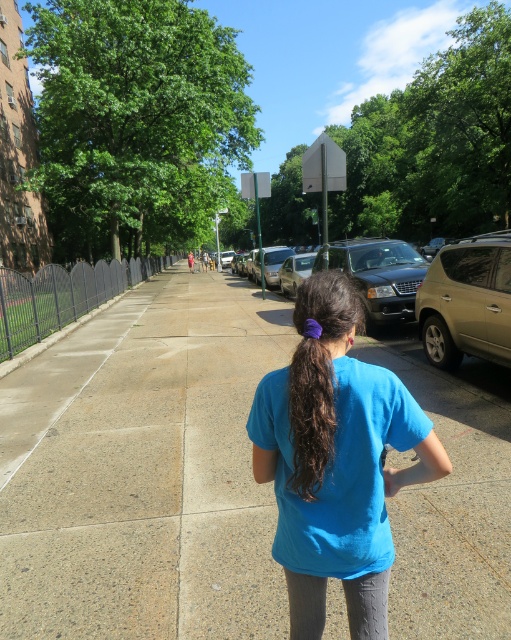
Who is lower down, gray concrete sidewalk at center or dark brown curly hair at center?

gray concrete sidewalk at center

Is gray concrete sidewalk at center taller than dark brown curly hair at center?

Yes.

This screenshot has width=511, height=640. I want to click on gray concrete sidewalk at center, so click(x=144, y=470).

Where is `gray concrete sidewalk at center`? gray concrete sidewalk at center is located at coordinates (144, 470).

Is point (443, 412) closer to viewer compared to point (362, 237)?

Yes, point (443, 412) is closer to viewer.

Which of these two, gray concrete sidewalk at center or shiny black sedan at center, stands taller?

shiny black sedan at center is taller.

Is point (469, 611) farther from camera compared to point (314, 260)?

That is False.

The image size is (511, 640). Identify the location of gray concrete sidewalk at center. (144, 470).

Is blue cotton shirt at center taller than gold metallic suv at right?

No, blue cotton shirt at center is not taller than gold metallic suv at right.

Does blue cotton shirt at center appear over gold metallic suv at right?

No, blue cotton shirt at center is not above gold metallic suv at right.

Which is in front, point (313, 349) or point (503, 352)?

Point (313, 349)

The height and width of the screenshot is (640, 511). I want to click on blue cotton shirt at center, so click(336, 461).